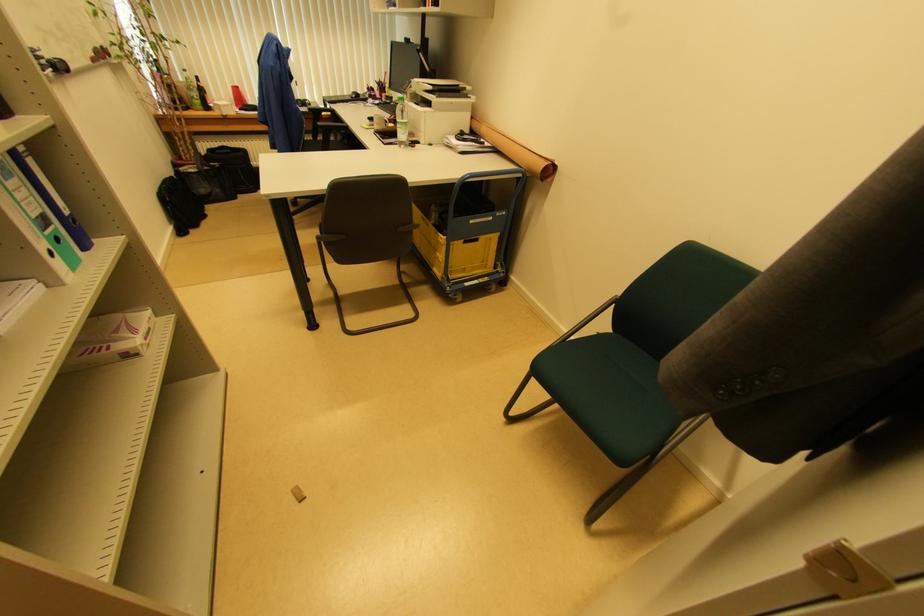
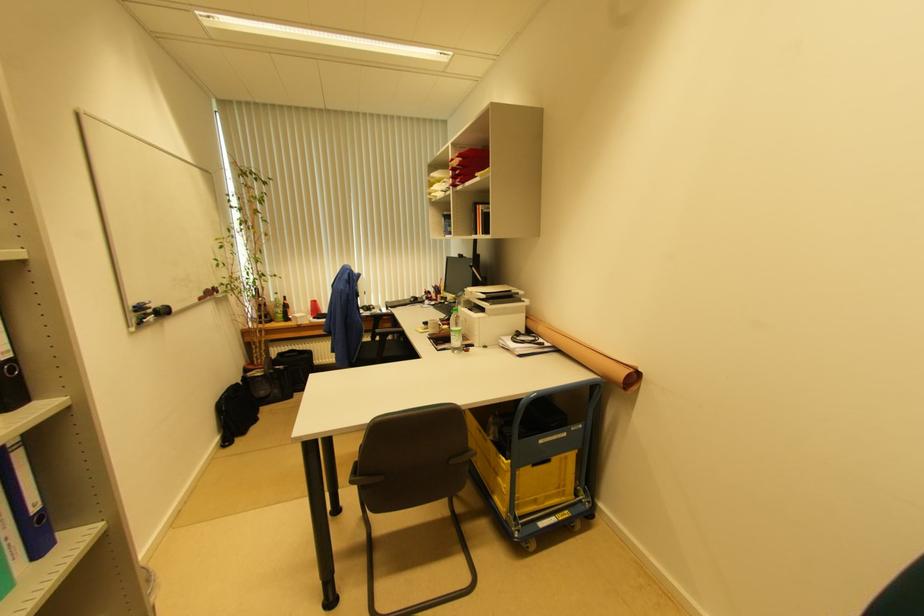
Find the pixel in the second image that matches point 473,120 in the first image.

(528, 320)